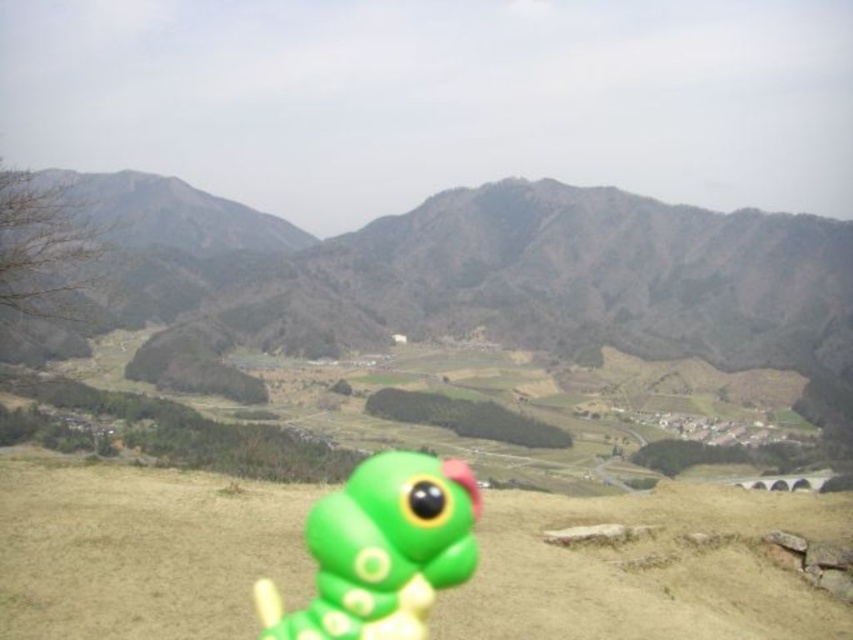
Question: Which object appears closest to the camera in this image?

Choices:
 (A) green matte toy at center
 (B) green matte toy at lower center

Answer: (B)

Question: In this image, where is green matte toy at center located relative to green matte toy at lower center?

Choices:
 (A) right
 (B) left

Answer: (A)

Question: Where is green matte toy at center located in relation to green matte toy at lower center in the image?

Choices:
 (A) left
 (B) right

Answer: (B)

Question: Is green matte toy at center positioned in front of green matte toy at lower center?

Choices:
 (A) yes
 (B) no

Answer: (B)

Question: Among these points, which one is farthest from the camera?

Choices:
 (A) 312,513
 (B) 437,604

Answer: (A)